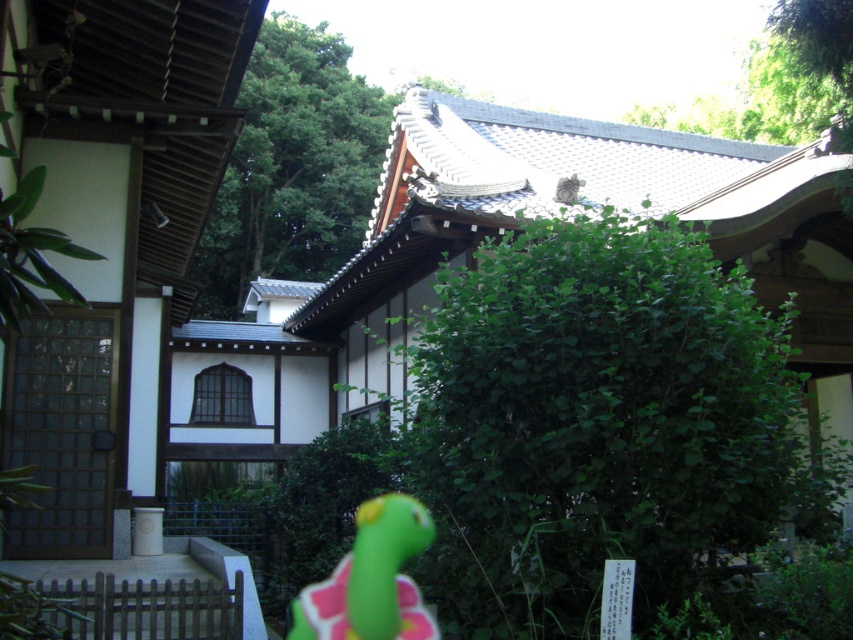
Question: Which object is farther from the camera taking this photo?

Choices:
 (A) gray furry cat at upper center
 (B) green rubber toy at lower center
 (C) green leafy bush at center
 (D) green leafy tree at upper center

Answer: (A)

Question: Considering the relative positions of green leafy bush at center and green leafy tree at upper center in the image provided, where is green leafy bush at center located with respect to green leafy tree at upper center?

Choices:
 (A) below
 (B) above

Answer: (A)

Question: From the image, what is the correct spatial relationship of green leafy bush at center in relation to gray furry cat at upper center?

Choices:
 (A) above
 (B) below

Answer: (B)

Question: In this image, where is green leafy tree at upper center located relative to green rubber toy at lower center?

Choices:
 (A) left
 (B) right

Answer: (A)

Question: Which point appears closest to the camera in this image?

Choices:
 (A) (345, 621)
 (B) (555, 196)
 (C) (438, 524)

Answer: (C)

Question: Which object appears farthest from the camera in this image?

Choices:
 (A) green leafy bush at center
 (B) gray furry cat at upper center
 (C) green leafy tree at upper center

Answer: (B)